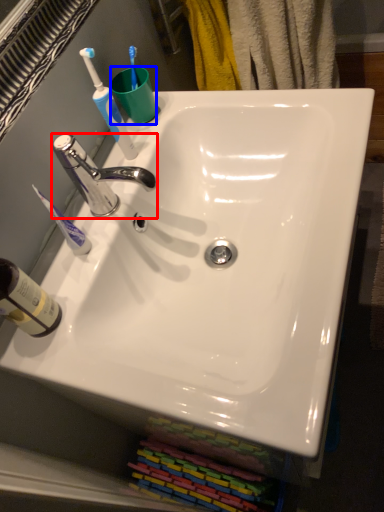
Question: Which object appears farthest to the camera in this image, tap (highlighted by a red box) or coffee cup (highlighted by a blue box)?

Choices:
 (A) tap
 (B) coffee cup

Answer: (B)